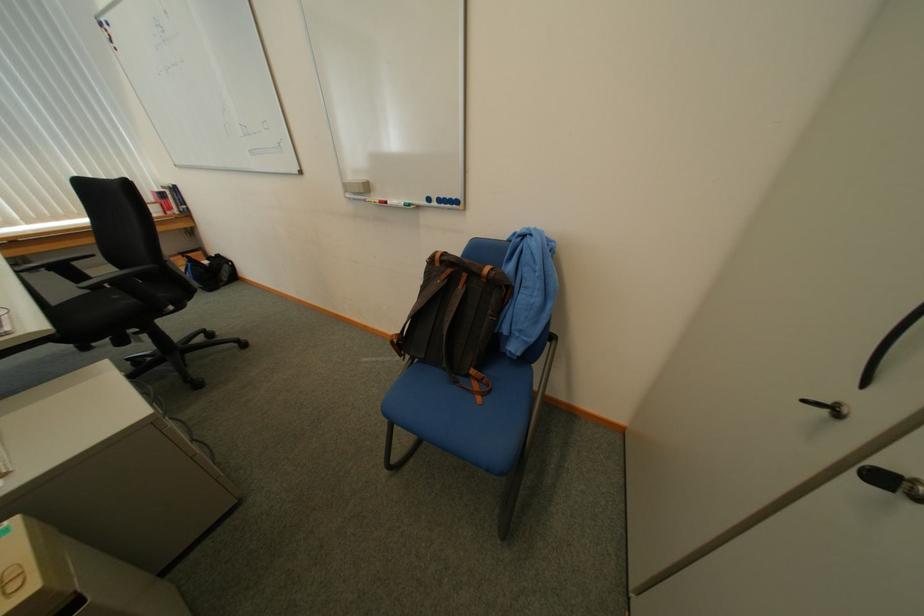
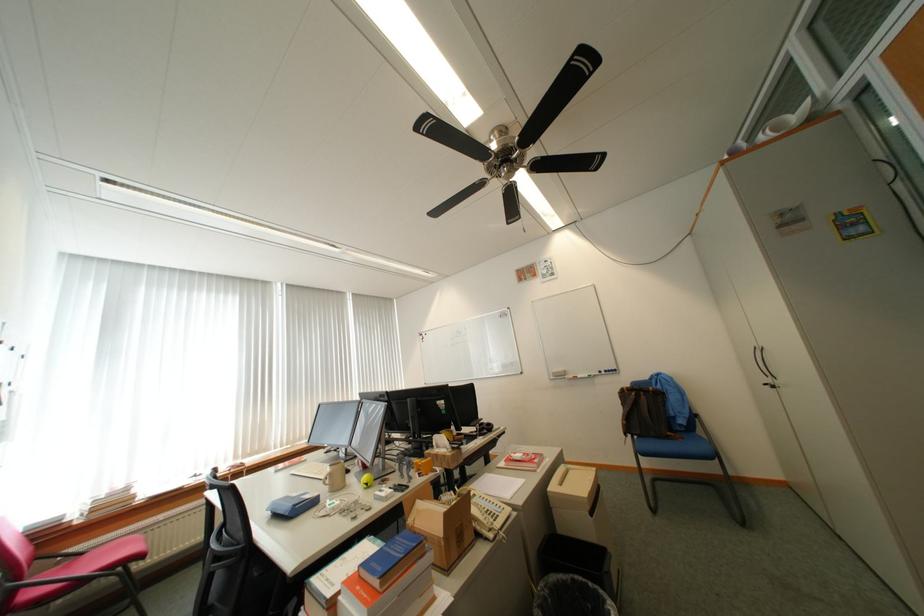
In the second image, find the point that corresponds to (469,290) in the first image.

(652, 399)